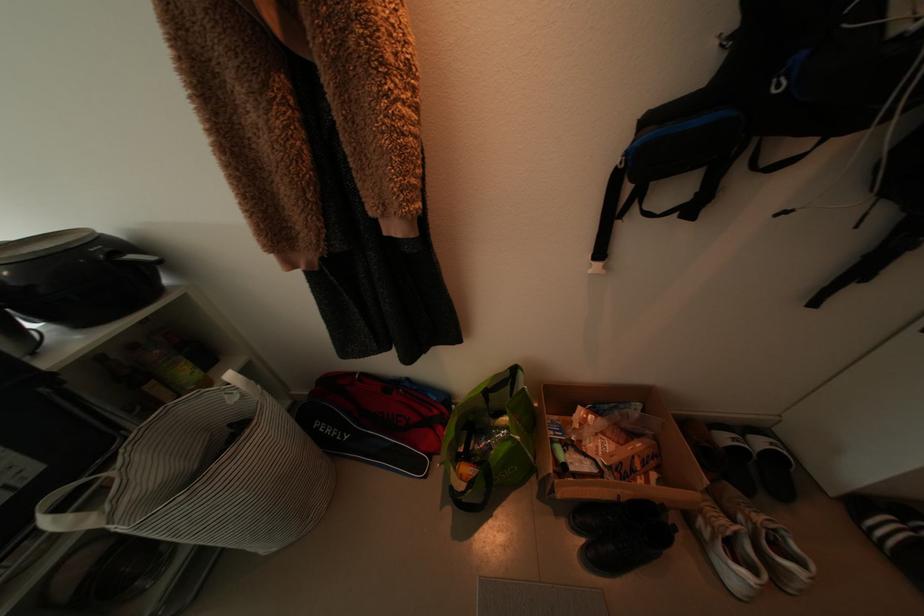
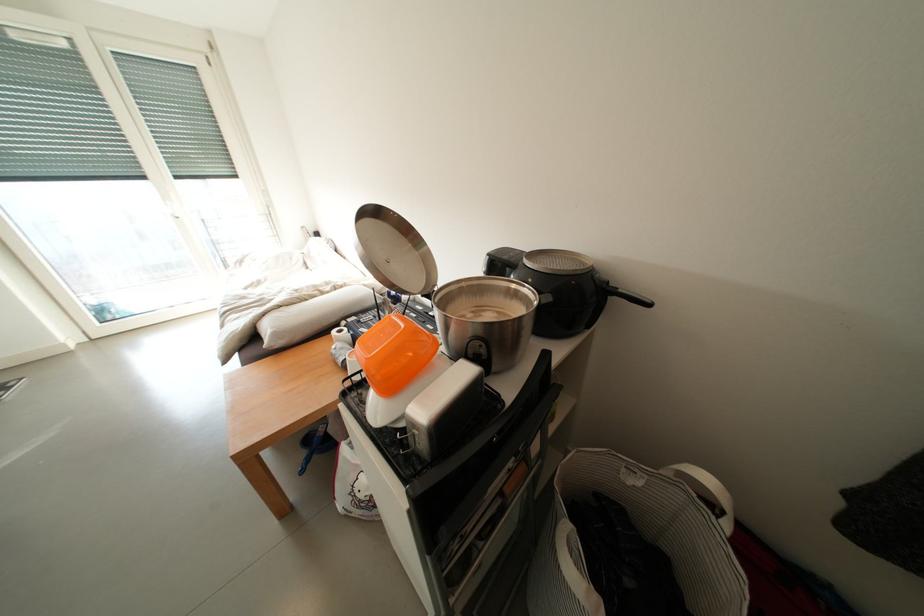
Question: How did the camera likely rotate?

Choices:
 (A) Left
 (B) Right
 (C) Up
 (D) Down

Answer: (A)